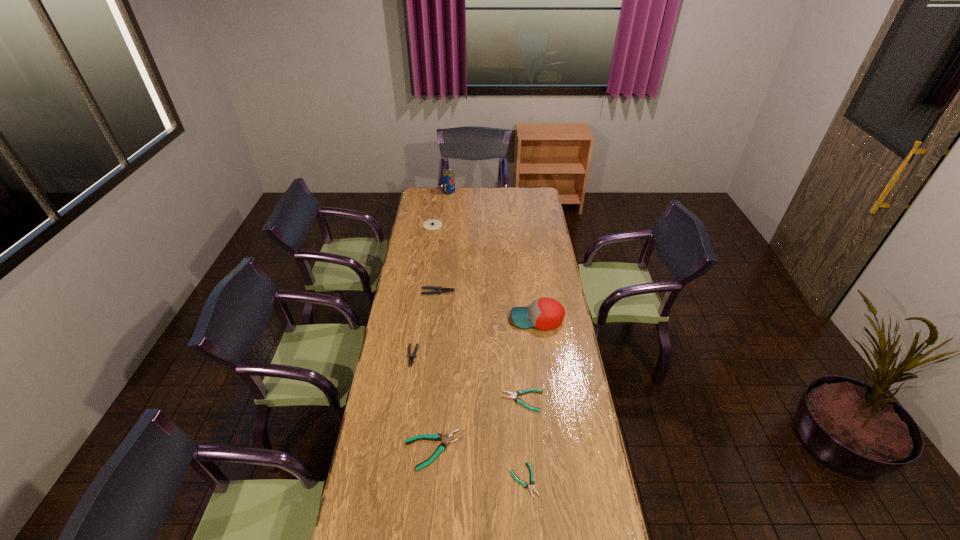
Find the location of a particular element. Image resolution: width=960 pixels, height=540 pixels. vacant area located 0.070m on the left of the compass is located at coordinates (412, 225).

Locate an element on the screen. Image resolution: width=960 pixels, height=540 pixels. free spot located 0.120m at the gripping part of the third farthest object is located at coordinates (478, 292).

Where is `free location located 0.360m at the gripping part of the nearer gray pliers`? free location located 0.360m at the gripping part of the nearer gray pliers is located at coordinates (399, 448).

Locate an element on the screen. The width and height of the screenshot is (960, 540). vacant space located on the back of the third shortest object is located at coordinates (438, 394).

The height and width of the screenshot is (540, 960). I want to click on vacant point located on the left of the second biggest teal pliers, so click(444, 401).

Image resolution: width=960 pixels, height=540 pixels. I want to click on free region located 0.240m on the left of the shortest object, so click(x=440, y=480).

Where is `object situated at the far edge`? The height and width of the screenshot is (540, 960). object situated at the far edge is located at coordinates (448, 179).

Find the location of a particular element. Image resolution: width=960 pixels, height=540 pixels. compass that is positioned at the left edge is located at coordinates [433, 224].

The height and width of the screenshot is (540, 960). In order to click on baseball cap present at the right edge in this screenshot , I will do `click(545, 313)`.

I want to click on pliers present at the right edge, so click(520, 392).